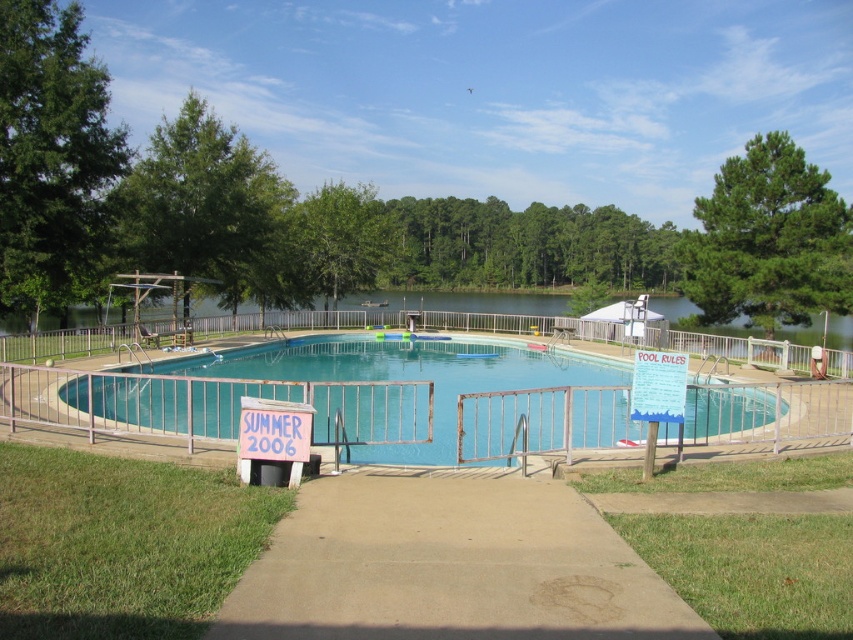
Question: Is green leafy tree at left smaller than green pine tree at upper right?

Choices:
 (A) yes
 (B) no

Answer: (A)

Question: Among these points, which one is farthest from the camera?

Choices:
 (A) (339, 259)
 (B) (74, 168)
 (C) (149, 252)
 (D) (653, 380)

Answer: (A)

Question: Which of the following is the farthest from the observer?

Choices:
 (A) green leafy tree at upper left
 (B) green pine tree at upper right
 (C) green leafy tree at center
 (D) white paper sign at upper right

Answer: (C)

Question: Considering the real-world distances, which object is closest to the green leafy trees at center?

Choices:
 (A) green leafy tree at upper left
 (B) green leafy tree at center
 (C) green leafy tree at left
 (D) white paper sign at upper right

Answer: (B)

Question: Is the position of green leafy trees at center more distant than that of white paper sign at upper right?

Choices:
 (A) no
 (B) yes

Answer: (B)

Question: Where is green leafy trees at center located in relation to green leafy tree at center in the image?

Choices:
 (A) right
 (B) left

Answer: (A)